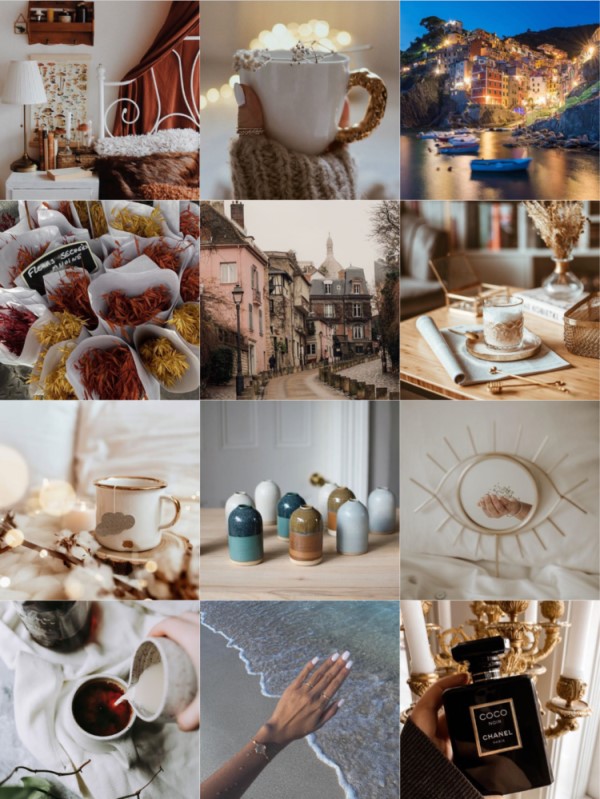
This screenshot has height=799, width=600. I want to click on cups, so click(x=103, y=733), click(x=177, y=690), click(x=126, y=527), click(x=304, y=100).